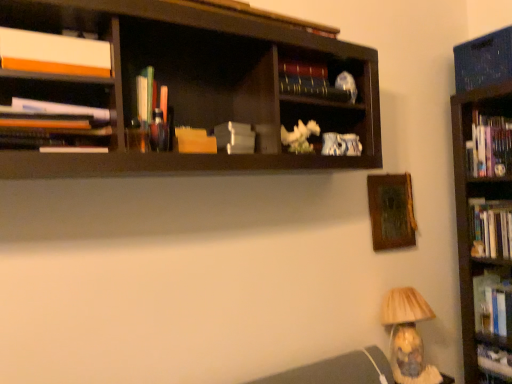
Question: Does white matte book at upper left, which is the third book from top to bottom, have a larger size compared to wooden picture frame at upper right?

Choices:
 (A) no
 (B) yes

Answer: (A)

Question: Is white matte book at upper left, the ninth book in the bottom-to-top sequence, taller than wooden picture frame at upper right?

Choices:
 (A) yes
 (B) no

Answer: (B)

Question: Is the depth of white matte book at upper left, the ninth book in the bottom-to-top sequence, greater than that of wooden picture frame at upper right?

Choices:
 (A) yes
 (B) no

Answer: (B)

Question: Does white matte book at upper left, which is the third book from top to bottom, have a greater width compared to wooden picture frame at upper right?

Choices:
 (A) yes
 (B) no

Answer: (A)

Question: Could you tell me if white matte book at upper left, the ninth book in the bottom-to-top sequence, is facing wooden picture frame at upper right?

Choices:
 (A) yes
 (B) no

Answer: (B)

Question: Does point (88, 135) appear closer or farther from the camera than point (495, 175)?

Choices:
 (A) farther
 (B) closer

Answer: (B)

Question: Looking at the image, does matte white papers at left, which ranks as the sixth book in top-to-bottom order, seem bigger or smaller compared to hardcover books at right, the 8th book from the bottom?

Choices:
 (A) small
 (B) big

Answer: (A)

Question: From the image's perspective, is matte white papers at left, which is the 6th book from bottom to top, located above or below hardcover books at right, which is the fourth book in top-to-bottom order?

Choices:
 (A) below
 (B) above

Answer: (A)

Question: Looking at their shapes, would you say matte white papers at left, which ranks as the sixth book in top-to-bottom order, is wider or thinner than hardcover books at right, the 8th book from the bottom?

Choices:
 (A) thin
 (B) wide

Answer: (A)

Question: Is hardcover book at upper center, the 10th book in the bottom-to-top sequence, bigger or smaller than matte white papers at left, which is the 6th book from bottom to top?

Choices:
 (A) small
 (B) big

Answer: (A)

Question: Do you think hardcover book at upper center, positioned as the 2th book in top-to-bottom order, is within matte white papers at left, which is the 6th book from bottom to top, or outside of it?

Choices:
 (A) inside
 (B) outside

Answer: (B)

Question: Considering the relative positions of hardcover book at upper center, positioned as the 2th book in top-to-bottom order, and matte white papers at left, which is the 6th book from bottom to top, in the image provided, is hardcover book at upper center, positioned as the 2th book in top-to-bottom order, to the left or to the right of matte white papers at left, which is the 6th book from bottom to top,?

Choices:
 (A) left
 (B) right

Answer: (B)

Question: From a real-world perspective, is hardcover book at upper center, positioned as the 2th book in top-to-bottom order, above or below matte white papers at left, which ranks as the sixth book in top-to-bottom order?

Choices:
 (A) below
 (B) above

Answer: (B)

Question: In terms of height, does hardcover book at right, the 9th book when ordered from top to bottom, look taller or shorter compared to hardcover book at upper center, positioned as the 2th book in top-to-bottom order?

Choices:
 (A) short
 (B) tall

Answer: (B)

Question: Would you say hardcover book at right, which ranks as the third book in bottom-to-top order, is to the left or to the right of hardcover book at upper center, the 10th book in the bottom-to-top sequence, in the picture?

Choices:
 (A) left
 (B) right

Answer: (B)